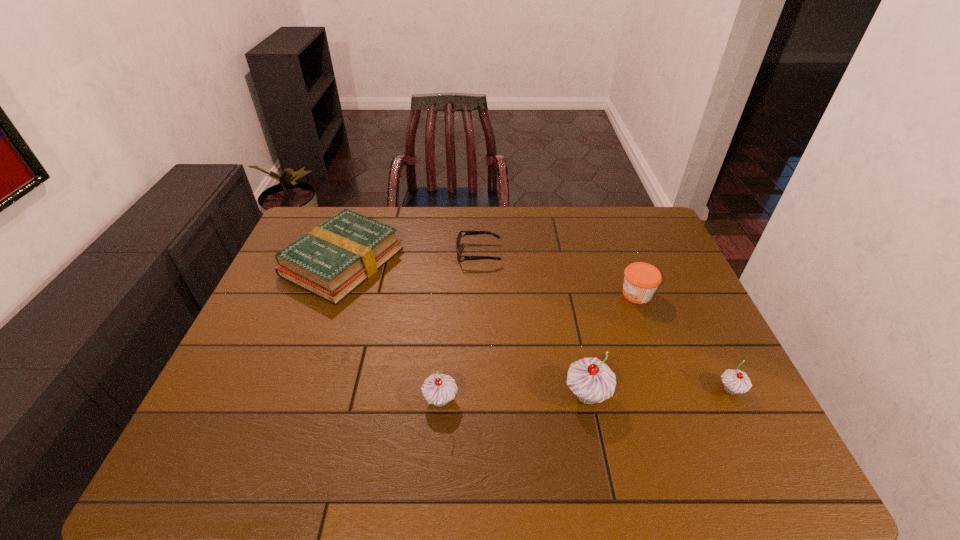
This screenshot has height=540, width=960. I want to click on free space for a new cupcake on the left, so click(x=291, y=405).